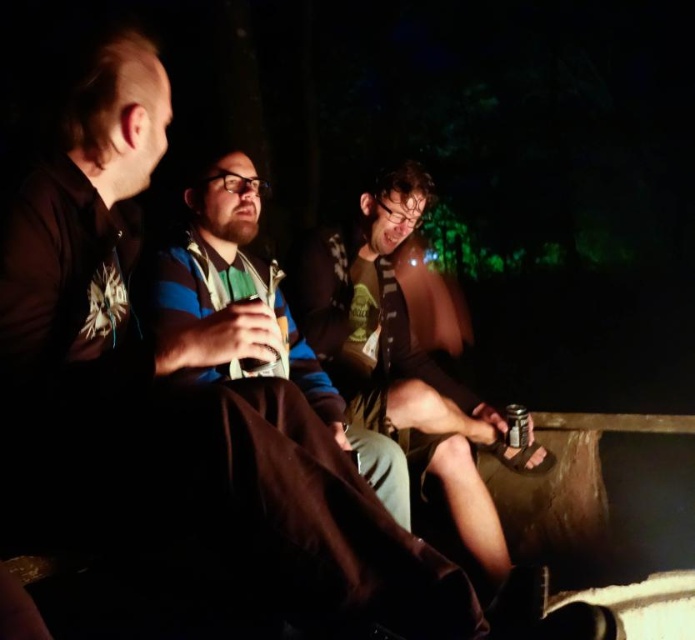
Question: Considering the real-world distances, which object is closest to the blue striped shirt at center?

Choices:
 (A) metallic can at center
 (B) shiny black jacket at center

Answer: (A)

Question: Is the position of blue striped shirt at center less distant than that of metallic can at lower right?

Choices:
 (A) yes
 (B) no

Answer: (A)

Question: Can you confirm if blue striped shirt at center is thinner than metallic can at lower right?

Choices:
 (A) no
 (B) yes

Answer: (A)

Question: Is shiny black jacket at center smaller than metallic can at lower right?

Choices:
 (A) no
 (B) yes

Answer: (A)

Question: Which of the following is the closest to the observer?

Choices:
 (A) metallic can at lower right
 (B) blue striped shirt at center

Answer: (B)

Question: Which point is closer to the camera?

Choices:
 (A) metallic can at lower right
 (B) shiny black jacket at center
 (C) metallic can at center
 (D) blue striped shirt at center

Answer: (D)